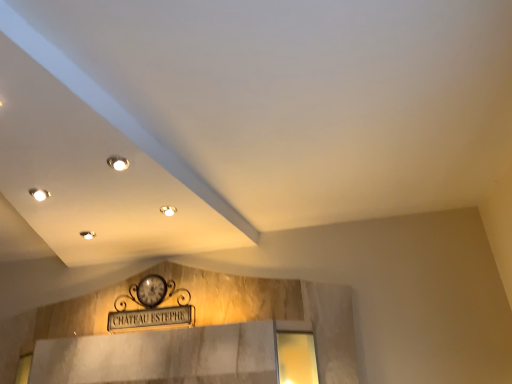
This screenshot has width=512, height=384. Describe the element at coordinates (118, 163) in the screenshot. I see `matte white recessed light at upper center` at that location.

This screenshot has width=512, height=384. In order to click on matte white recessed light at upper center in this screenshot , I will do `click(118, 163)`.

The width and height of the screenshot is (512, 384). Find the location of `matte white recessed light at upper center`. matte white recessed light at upper center is located at coordinates (118, 163).